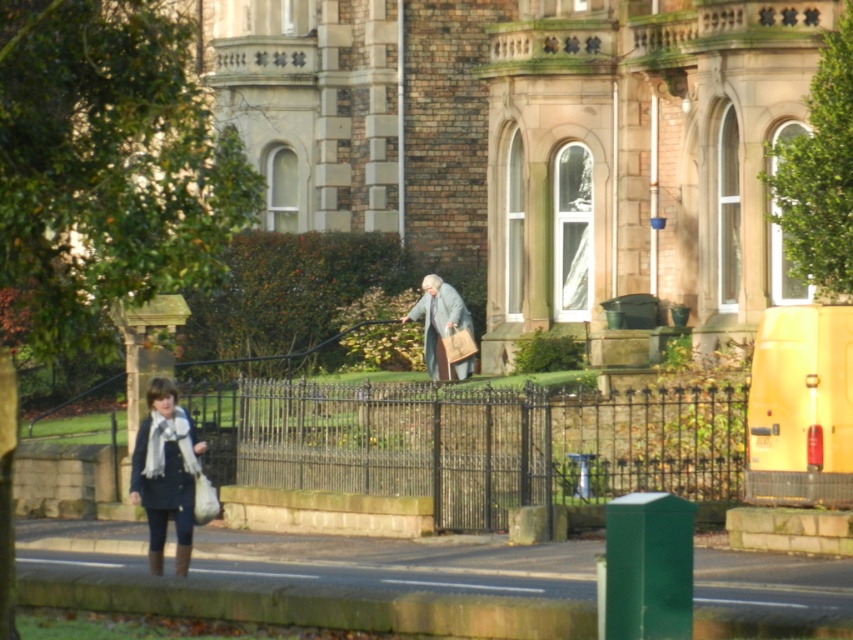
Is green stone pavement at lower center in front of light gray woolen robe at center?

Yes, it is in front of light gray woolen robe at center.

Where is `green stone pavement at lower center`? green stone pavement at lower center is located at coordinates (399, 564).

What are the coordinates of `green stone pavement at lower center` in the screenshot? It's located at (399, 564).

Which is more to the left, knitted wool scarf at lower left or light gray woolen robe at center?

knitted wool scarf at lower left is more to the left.

Is knitted wool scarf at lower left below light gray woolen robe at center?

Yes.

Is point (161, 488) closer to camera compared to point (433, 304)?

Yes, point (161, 488) is in front of point (433, 304).

Find the location of `knitted wool scarf at lower left`. knitted wool scarf at lower left is located at coordinates (166, 476).

Is point (207, 531) positioned in front of point (183, 525)?

That is False.

Which is behind, point (845, 570) or point (193, 452)?

The point (193, 452) is more distant.

Identify the location of green stone pavement at lower center. (399, 564).